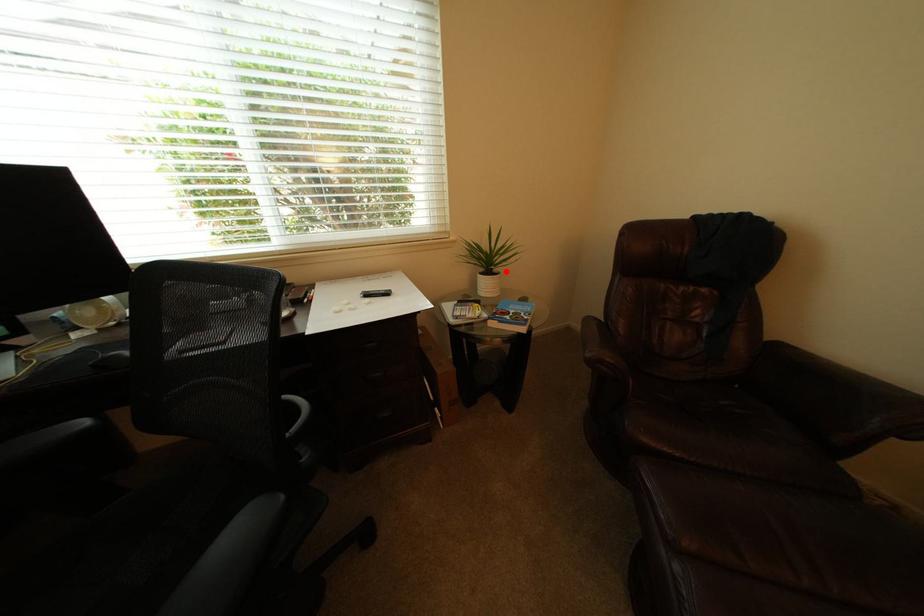
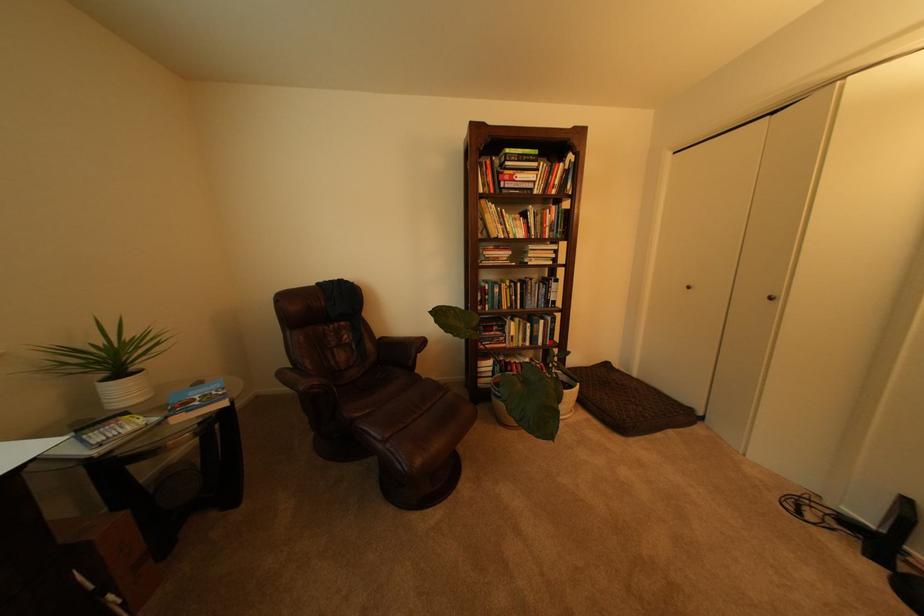
Question: I am providing you with two images of the same scene from different viewpoints. Given a red point in image1, look at the same physical point in image2. Is it:

Choices:
 (A) Closer to the viewpoint
 (B) Farther from the viewpoint

Answer: (B)